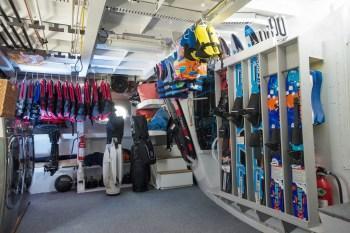
In order to click on ceiling in this screenshot , I will do `click(124, 30)`.